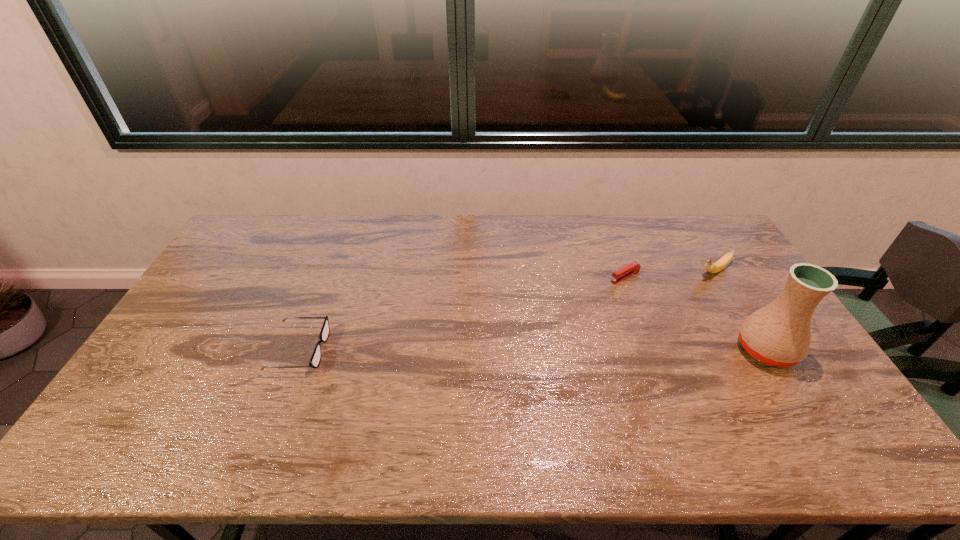
Identify the location of object that is the third closest to the tallest object. (314, 362).

Image resolution: width=960 pixels, height=540 pixels. I want to click on object that is the third closest one to the stapler, so click(314, 362).

Locate an element on the screen. The height and width of the screenshot is (540, 960). free region that satisfies the following two spatial constraints: 1. on the front side of the banana; 2. on the right side of the pottery is located at coordinates (761, 349).

This screenshot has width=960, height=540. What are the coordinates of `vacant area in the image that satisfies the following two spatial constraints: 1. on the front side of the second object from left to right; 2. on the right side of the tallest object` in the screenshot? It's located at (652, 349).